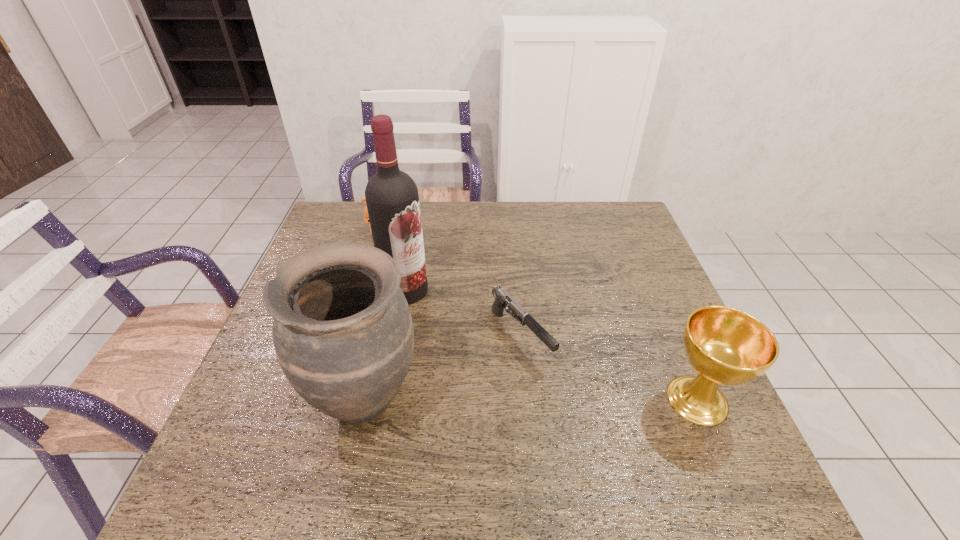
You are a GUI agent. You are given a task and a screenshot of the screen. Output one action in this format:
    pyautogui.click(x=<x>, y=<y>)
    Task: Click on the object at the far edge
    
    Given the screenshot: What is the action you would take?
    pyautogui.click(x=366, y=218)

Locate an element on the screen. Image resolution: width=960 pixels, height=540 pixels. urn that is at the near edge is located at coordinates (343, 334).

Locate an element on the screen. Image resolution: width=960 pixels, height=540 pixels. chalice that is positioned at the near edge is located at coordinates pos(726,346).

The image size is (960, 540). Identify the location of urn present at the left edge. (343, 334).

Where is `teddy bear located in the left edge section of the desktop`? Image resolution: width=960 pixels, height=540 pixels. teddy bear located in the left edge section of the desktop is located at coordinates (366, 218).

Image resolution: width=960 pixels, height=540 pixels. Find the location of `object at the right edge`. object at the right edge is located at coordinates (726, 346).

This screenshot has width=960, height=540. I want to click on object situated at the far left corner, so click(366, 218).

The width and height of the screenshot is (960, 540). Find the location of `object that is positioned at the near left corner`. object that is positioned at the near left corner is located at coordinates (343, 334).

This screenshot has height=540, width=960. I want to click on object at the near right corner, so click(726, 346).

The image size is (960, 540). I want to click on blank space at the far edge of the desktop, so click(x=490, y=216).